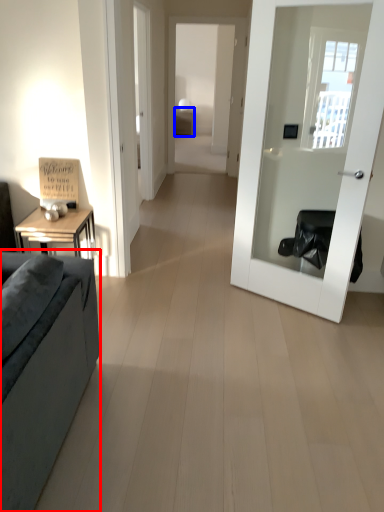
Question: Which of the following is the closest to the observer, studio couch (highlighted by a red box) or table (highlighted by a blue box)?

Choices:
 (A) studio couch
 (B) table

Answer: (A)